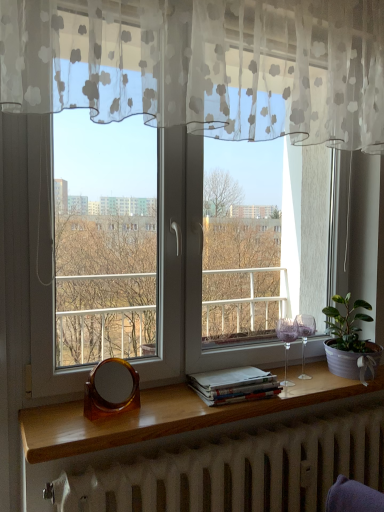
Question: Does brown tortoiseshell mirror at lower center lie in front of green leafy plant in textured pot at right?

Choices:
 (A) yes
 (B) no

Answer: (A)

Question: Is brown tortoiseshell mirror at lower center at the right side of green leafy plant in textured pot at right?

Choices:
 (A) no
 (B) yes

Answer: (A)

Question: From a real-world perspective, is brown tortoiseshell mirror at lower center physically above green leafy plant in textured pot at right?

Choices:
 (A) no
 (B) yes

Answer: (A)

Question: Could you tell me if brown tortoiseshell mirror at lower center is turned towards green leafy plant in textured pot at right?

Choices:
 (A) yes
 (B) no

Answer: (B)

Question: Is brown tortoiseshell mirror at lower center turned away from green leafy plant in textured pot at right?

Choices:
 (A) no
 (B) yes

Answer: (A)

Question: Visually, is white matte radiator at lower center positioned to the left or to the right of green leafy plant in textured pot at right?

Choices:
 (A) right
 (B) left

Answer: (B)

Question: Would you say white matte radiator at lower center is inside or outside green leafy plant in textured pot at right?

Choices:
 (A) outside
 (B) inside

Answer: (A)

Question: Is point (147, 475) closer or farther from the camera than point (349, 309)?

Choices:
 (A) closer
 (B) farther

Answer: (A)

Question: From the image's perspective, is white matte radiator at lower center above or below green leafy plant in textured pot at right?

Choices:
 (A) below
 (B) above

Answer: (A)

Question: Looking at their shapes, would you say white paper stack at lower center is wider or thinner than wooden at lower center?

Choices:
 (A) wide
 (B) thin

Answer: (B)

Question: Does point (236, 393) appear closer or farther from the camera than point (314, 396)?

Choices:
 (A) closer
 (B) farther

Answer: (A)

Question: Considering the positions of white paper stack at lower center and wooden at lower center in the image, is white paper stack at lower center taller or shorter than wooden at lower center?

Choices:
 (A) short
 (B) tall

Answer: (B)

Question: From a real-world perspective, is white paper stack at lower center above or below wooden at lower center?

Choices:
 (A) above
 (B) below

Answer: (A)

Question: From the image's perspective, is green leafy plant in textured pot at right positioned above or below brown tortoiseshell mirror at lower center?

Choices:
 (A) below
 (B) above

Answer: (B)

Question: Considering their positions, is green leafy plant in textured pot at right located in front of or behind brown tortoiseshell mirror at lower center?

Choices:
 (A) behind
 (B) front

Answer: (A)